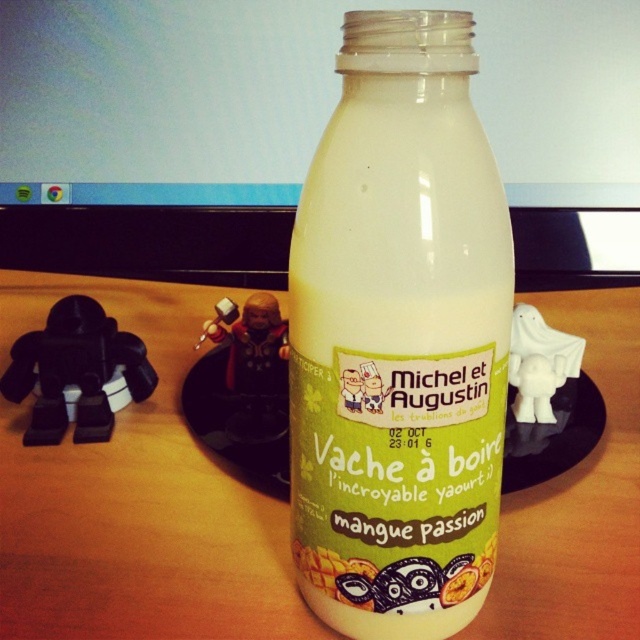
You are organizing a desk display and want to place a small decorative item between the metallic figure at center and the matte plastic figurine at center. Which figurine should you place the item closer to if you want it to be closer to the taller one?

The metallic figure at center is taller than the matte plastic figurine at center, so placing the item closer to the metallic figure at center will position it nearer to the taller one.

Based on the photo, you need to place a new object that is 15 cm wide on the desk. The desk has space near the matte plastic computer screen at upper center and the matte plastic figurine at center. Which location has enough space for the new object?

The matte plastic computer screen at upper center has a width larger than the matte plastic figurine at center, so the space near the matte plastic computer screen at upper center is wider and can accommodate the 15 cm wide object.